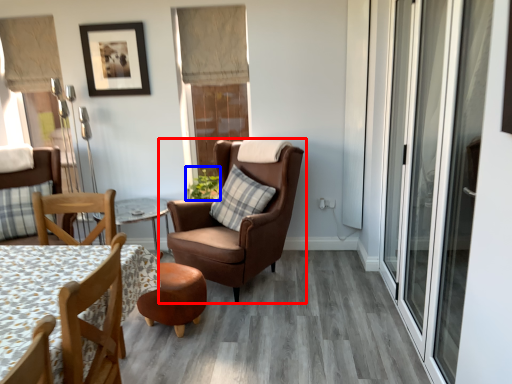
Question: Among these objects, which one is farthest to the camera, chair (highlighted by a red box) or plant (highlighted by a blue box)?

Choices:
 (A) chair
 (B) plant

Answer: (B)